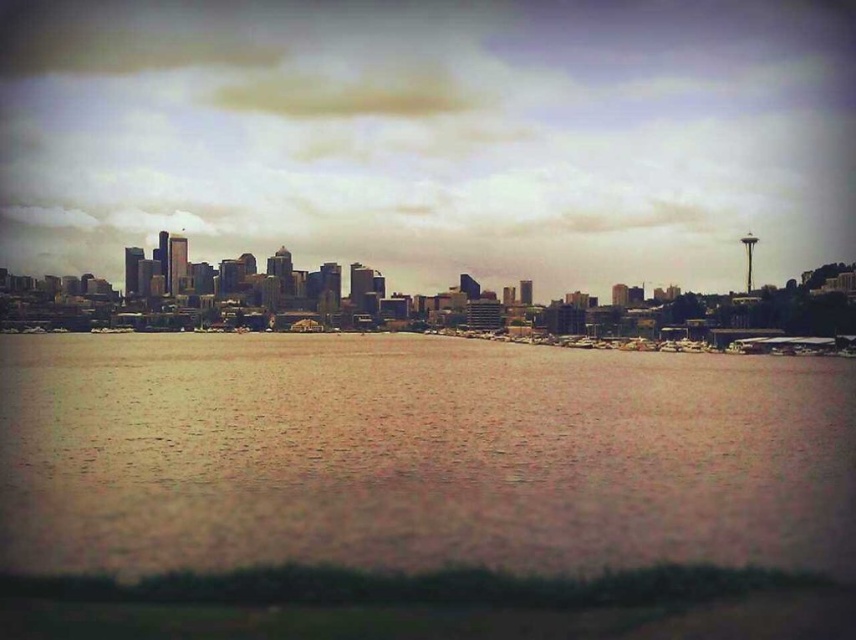
Who is more distant from viewer, (852, 365) or (752, 342)?

The point (852, 365) is more distant.

Does brown water at center appear under metallic gray boats at center?

Correct, brown water at center is located below metallic gray boats at center.

This screenshot has width=856, height=640. What do you see at coordinates (417, 454) in the screenshot?
I see `brown water at center` at bounding box center [417, 454].

The image size is (856, 640). In order to click on brown water at center in this screenshot , I will do `click(417, 454)`.